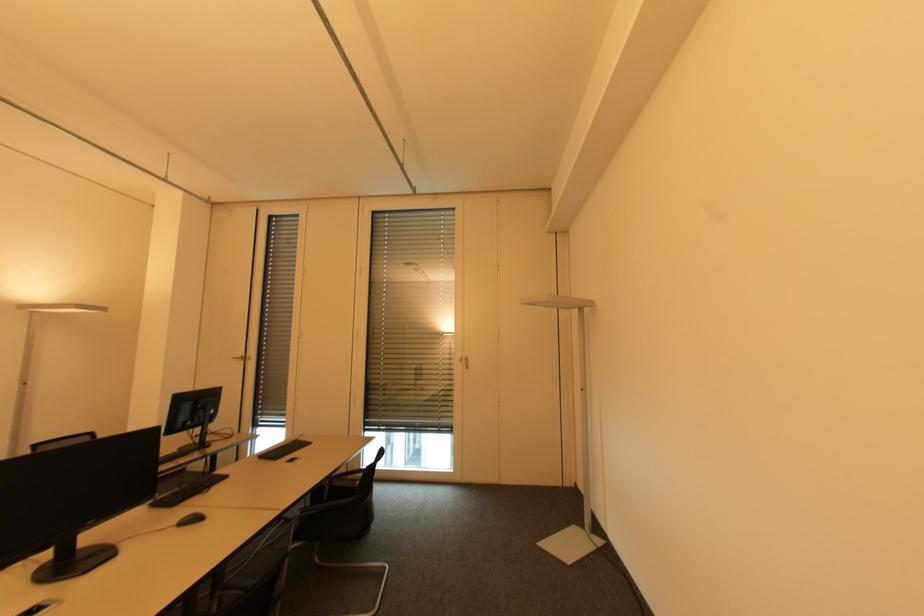
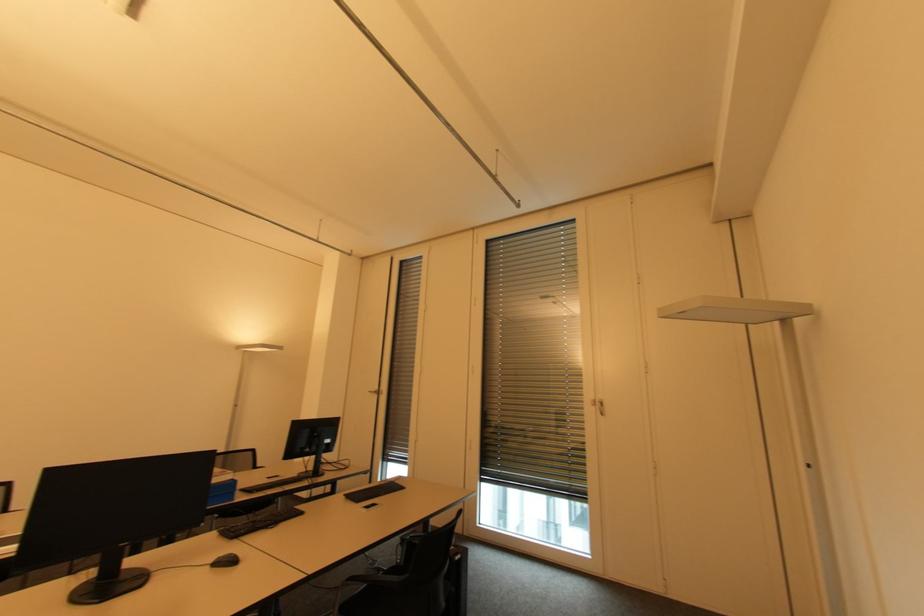
Locate, in the second image, the point that corresponds to (x=468, y=369) in the first image.

(603, 416)